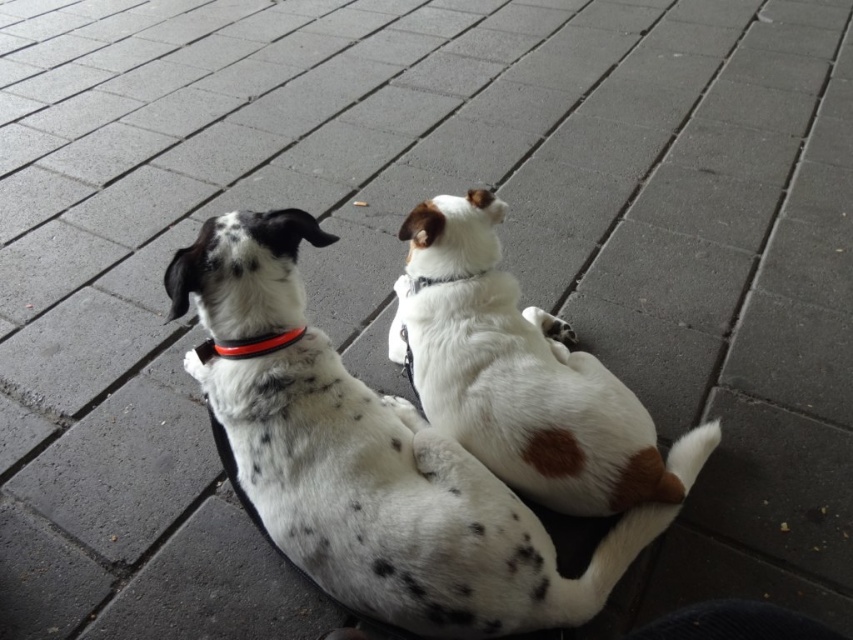
Is white fur dog at center wider than white fabric neckband at upper center?

Yes, white fur dog at center is wider than white fabric neckband at upper center.

Is white fur dog at center smaller than white fabric neckband at upper center?

No.

Between point (396, 355) and point (433, 284), which one is positioned behind?

Point (396, 355)

You are a GUI agent. You are given a task and a screenshot of the screen. Output one action in this format:
    pyautogui.click(x=<x>, y=<y>)
    Task: Click on the white fur dog at center
    This screenshot has height=640, width=853.
    Given the screenshot: What is the action you would take?
    pyautogui.click(x=523, y=376)

Is spotted fur dog at center above white fabric neckband at upper center?

No, spotted fur dog at center is not above white fabric neckband at upper center.

Who is shorter, spotted fur dog at center or white fabric neckband at upper center?

white fabric neckband at upper center is shorter.

Is point (439, 484) positioned before point (415, 291)?

That is True.

I want to click on spotted fur dog at center, so click(x=367, y=461).

Is spotted fur dog at center above white fur dog at center?

Actually, spotted fur dog at center is below white fur dog at center.

Who is shorter, spotted fur dog at center or white fur dog at center?

Standing shorter between the two is white fur dog at center.

I want to click on spotted fur dog at center, so click(367, 461).